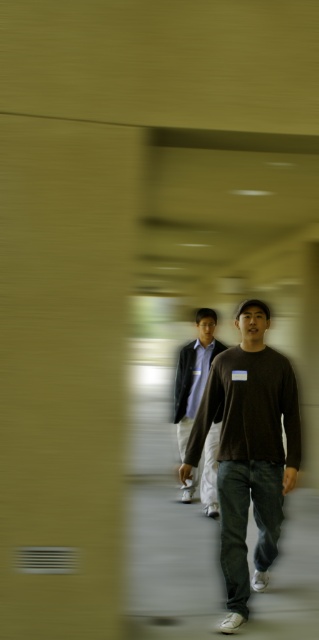
Who is lower down, dark brown cotton shirt at center or matte gray sweater at center?

dark brown cotton shirt at center

Image resolution: width=319 pixels, height=640 pixels. In order to click on dark brown cotton shirt at center in this screenshot , I will do `click(249, 451)`.

Which is in front, point (254, 305) or point (200, 314)?

Point (254, 305)

The height and width of the screenshot is (640, 319). Find the location of `dark brown cotton shirt at center`. dark brown cotton shirt at center is located at coordinates coord(249,451).